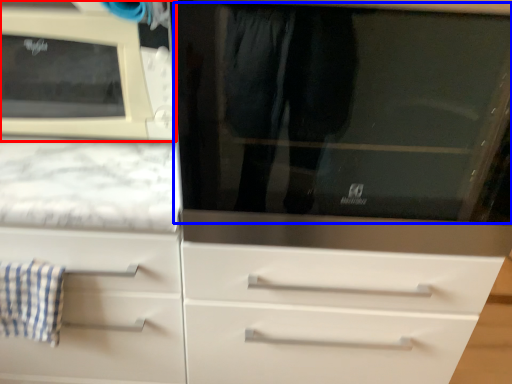
Question: Which object appears farthest to the camera in this image, microwave oven (highlighted by a red box) or glass door (highlighted by a blue box)?

Choices:
 (A) microwave oven
 (B) glass door

Answer: (A)